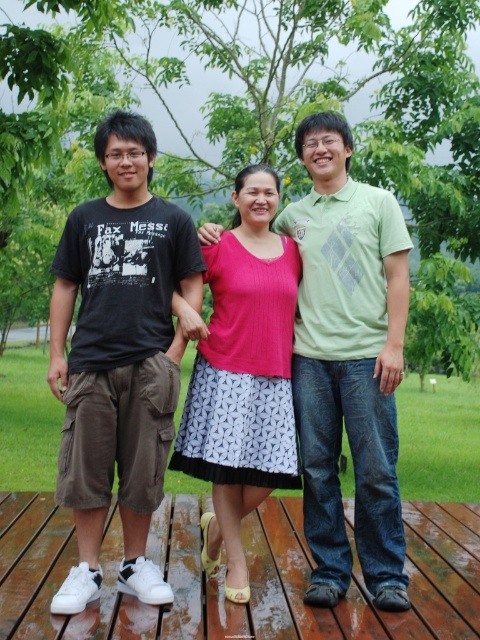
Question: Which object is farther from the camera taking this photo?

Choices:
 (A) pink knitwear at center
 (B) wooden at center

Answer: (A)

Question: Does green matte shirt at center appear on the left side of pink knitwear at center?

Choices:
 (A) no
 (B) yes

Answer: (A)

Question: Which of the following is the farthest from the observer?

Choices:
 (A) (162, 221)
 (B) (187, 611)
 (C) (304, 460)

Answer: (C)

Question: Is green matte shirt at center closer to the viewer compared to pink knitwear at center?

Choices:
 (A) yes
 (B) no

Answer: (A)

Question: Which of the following is the farthest from the observer?

Choices:
 (A) (132, 173)
 (B) (247, 387)
 (C) (29, 227)
 (D) (469, 570)

Answer: (C)

Question: Does green leafy tree at upper center appear on the left side of pink knitwear at center?

Choices:
 (A) yes
 (B) no

Answer: (A)